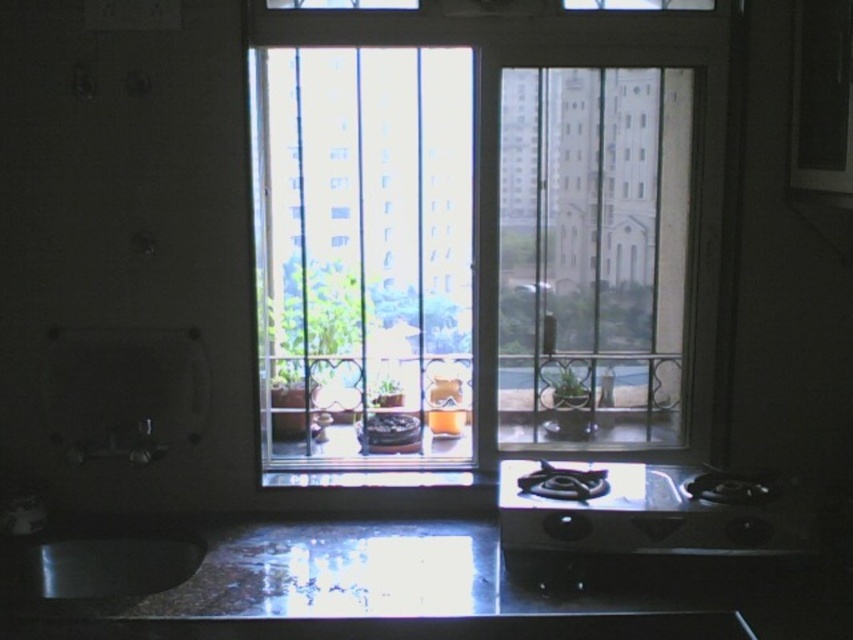
You are a delivery person trying to place a large package on the kitchen surface. The package is 1.2 meters wide. Looking at the glossy granite counter top at lower center and the clear glass window at center, which surface can accommodate the package in terms of width?

The glossy granite counter top at lower center can accommodate the package since it has a greater width than the clear glass window at center, and the package is 1.2 meters wide.

You are a chef who needs to wash vegetables. You see the shiny metallic sink at lower left and the green matte plant at center. Which object should you approach first to start washing the vegetables?

You should approach the shiny metallic sink at lower left first since it is to the left of the green matte plant at center, making it closer to your current position if you are standing near the sink area.